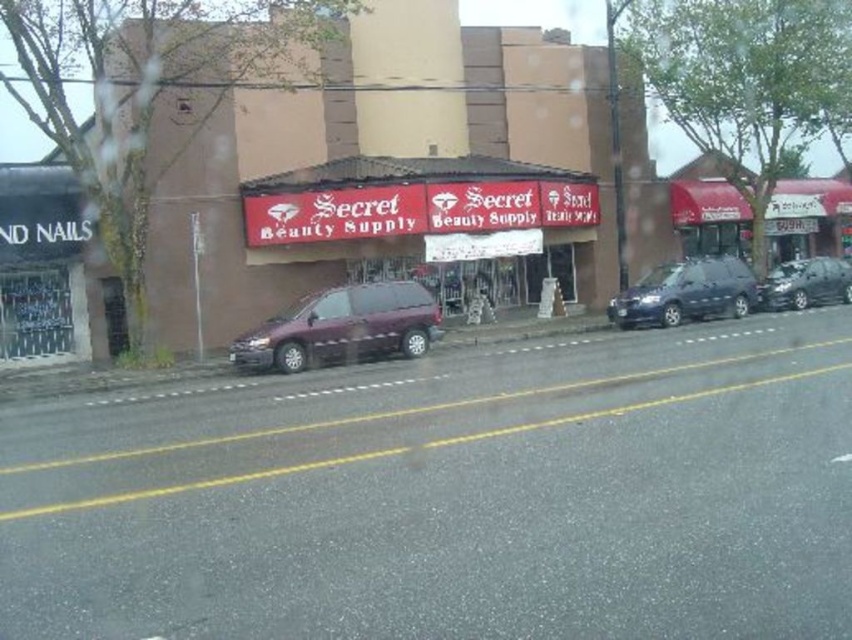
Is shiny black sedan at center positioned in front of matte purple van at center?

That is False.

Does shiny black sedan at center have a larger size compared to matte purple van at center?

No.

Image resolution: width=852 pixels, height=640 pixels. I want to click on shiny black sedan at center, so click(x=804, y=284).

Between purple matte van at center and shiny black sedan at center, which one is positioned higher?

shiny black sedan at center is above.

Does purple matte van at center appear on the left side of shiny black sedan at center?

Correct, you'll find purple matte van at center to the left of shiny black sedan at center.

Describe the element at coordinates (343, 326) in the screenshot. This screenshot has height=640, width=852. I see `purple matte van at center` at that location.

I want to click on purple matte van at center, so click(x=343, y=326).

Consider the image. Between purple matte van at center and satin black minivan at center, which one is positioned higher?

Positioned higher is satin black minivan at center.

Is purple matte van at center to the right of satin black minivan at center from the viewer's perspective?

No, purple matte van at center is not to the right of satin black minivan at center.

Locate an element on the screen. This screenshot has width=852, height=640. purple matte van at center is located at coordinates (343, 326).